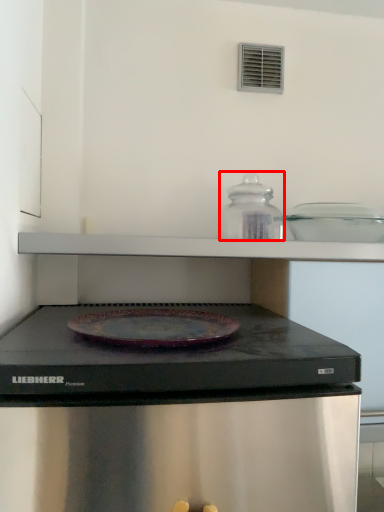
Question: From the image's perspective, what is the correct spatial positioning of appliance (annotated by the red box) in reference to appliance?

Choices:
 (A) below
 (B) above

Answer: (B)